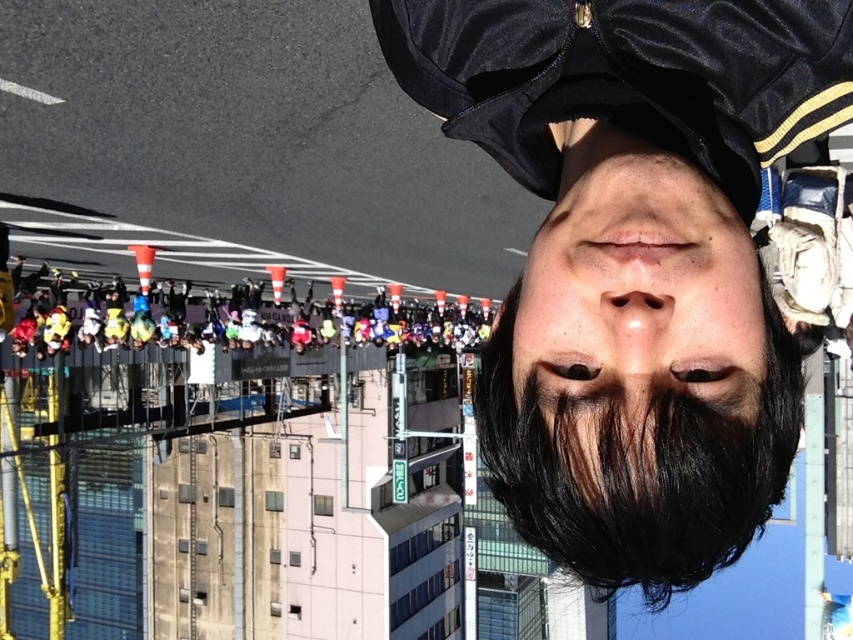
Question: Among these points, which one is farthest from the camera?

Choices:
 (A) (578, 358)
 (B) (633, 148)
 (C) (619, 550)

Answer: (B)

Question: Is black satin cap at upper center closer to camera compared to black matte eye at center?

Choices:
 (A) no
 (B) yes

Answer: (B)

Question: Is black matte beard at center to the right of dark brown hair at center from the viewer's perspective?

Choices:
 (A) yes
 (B) no

Answer: (A)

Question: Which point is farther to the camera?

Choices:
 (A) pos(683,364)
 (B) pos(675,193)
 (C) pos(625,314)

Answer: (A)

Question: Which object is closer to the camera taking this photo?

Choices:
 (A) matte skin nose at center
 (B) black matte beard at center

Answer: (A)

Question: Can you confirm if dark brown hair at center is bigger than matte skin nose at center?

Choices:
 (A) yes
 (B) no

Answer: (A)